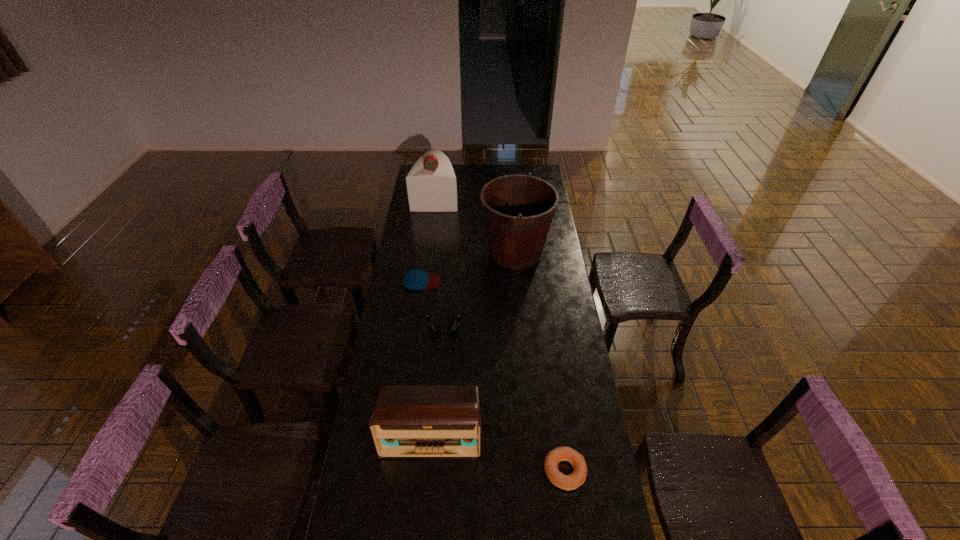
The width and height of the screenshot is (960, 540). Find the location of `vacant space situated on the ear cups of the third shortest object`. vacant space situated on the ear cups of the third shortest object is located at coordinates (443, 356).

Locate an element on the screen. This screenshot has width=960, height=540. vacant region located with the bill of the baseball cap facing forward is located at coordinates (505, 281).

Where is `vacant region located 0.230m on the left of the bagel`? vacant region located 0.230m on the left of the bagel is located at coordinates (473, 471).

You are a GUI agent. You are given a task and a screenshot of the screen. Output one action in this format:
    pyautogui.click(x=<x>, y=<y>)
    Task: Click on the object that is at the far edge
    This screenshot has width=960, height=540.
    Given the screenshot: What is the action you would take?
    pyautogui.click(x=431, y=184)

Image resolution: width=960 pixels, height=540 pixels. Find the location of `cake located in the left edge section of the desktop`. cake located in the left edge section of the desktop is located at coordinates (431, 184).

Identify the location of radio receiver that is positioned at the left edge. This screenshot has width=960, height=540. (408, 422).

You are a GUI agent. You are given a task and a screenshot of the screen. Output one action in this format:
    pyautogui.click(x=<x>, y=<y>)
    Task: Click on the baseball cap at the left edge
    This screenshot has width=960, height=540.
    Given the screenshot: What is the action you would take?
    pyautogui.click(x=415, y=279)

Identify the location of bucket at the right edge. (518, 210).

Locate an element on the screen. bagel that is at the right edge is located at coordinates (567, 482).

Identify the location of object positioned at the far left corner. (431, 184).